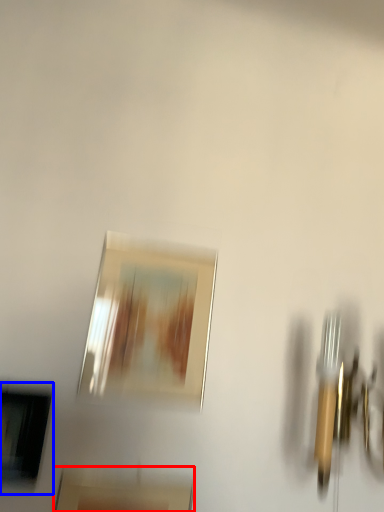
Question: Which object appears closest to the camera in this image, picture frame (highlighted by a red box) or picture frame (highlighted by a blue box)?

Choices:
 (A) picture frame
 (B) picture frame

Answer: (A)